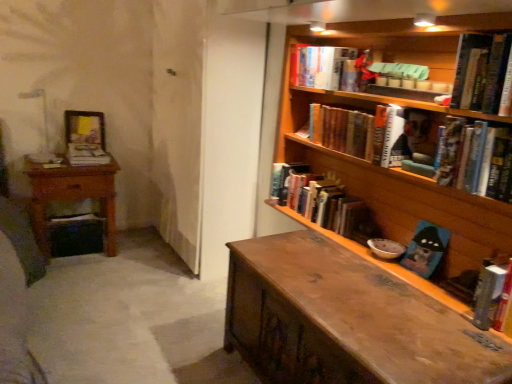
What is the approximate height of hardcover book at upper right, the 3th book positioned from the right?

9.70 inches.

Measure the distance between white matte book at left, placed as the first book when sorted from left to right, and camera.

white matte book at left, placed as the first book when sorted from left to right, is 8.66 feet from camera.

Describe the element at coordinates (87, 155) in the screenshot. The width and height of the screenshot is (512, 384). I see `white matte book at left, placed as the first book when sorted from left to right` at that location.

What do you see at coordinates (345, 320) in the screenshot? I see `wooden desk at center` at bounding box center [345, 320].

What do you see at coordinates (85, 128) in the screenshot? Image resolution: width=512 pixels, height=384 pixels. I see `wooden picture frame at upper left` at bounding box center [85, 128].

The height and width of the screenshot is (384, 512). I want to click on hardcover book at upper right, the 4th book viewed from the right, so click(369, 132).

The image size is (512, 384). I want to click on hardcover book at upper right, which ranks as the sixth book in left-to-right order, so click(x=482, y=72).

Describe the element at coordinates (482, 72) in the screenshot. I see `hardcover book at upper right, which ranks as the sixth book in left-to-right order` at that location.

This screenshot has width=512, height=384. What do you see at coordinates (322, 201) in the screenshot? I see `hardcover book at center, the 3th book positioned from the left` at bounding box center [322, 201].

Identify the location of hardcover book at upper right, the 3th book positioned from the right. (476, 158).

Are wooden nightstand at left and hardcover book at upper right, which appears as the 2th book when viewed from the right, located far from each other?

Yes, wooden nightstand at left and hardcover book at upper right, which appears as the 2th book when viewed from the right, are located far from each other.

Considering the sizes of objects wooden nightstand at left and hardcover book at upper right, which ranks as the sixth book in left-to-right order, in the image provided, who is shorter, wooden nightstand at left or hardcover book at upper right, which ranks as the sixth book in left-to-right order,?

Standing shorter between the two is hardcover book at upper right, which ranks as the sixth book in left-to-right order.

Considering the relative sizes of wooden nightstand at left and hardcover book at upper right, which ranks as the sixth book in left-to-right order, in the image provided, is wooden nightstand at left bigger than hardcover book at upper right, which ranks as the sixth book in left-to-right order,?

Correct, wooden nightstand at left is larger in size than hardcover book at upper right, which ranks as the sixth book in left-to-right order.

Is wooden nightstand at left turned away from hardcover book at upper right, which ranks as the sixth book in left-to-right order?

wooden nightstand at left does not have its back to hardcover book at upper right, which ranks as the sixth book in left-to-right order.

From the picture: Considering the relative sizes of wooden nightstand at left and hardcover book at upper right, the 5th book positioned from the left, in the image provided, is wooden nightstand at left smaller than hardcover book at upper right, the 5th book positioned from the left,?

Incorrect, wooden nightstand at left is not smaller in size than hardcover book at upper right, the 5th book positioned from the left.

Looking at this image, from a real-world perspective, which is physically below, wooden nightstand at left or hardcover book at upper right, the 3th book positioned from the right?

wooden nightstand at left, from a real-world perspective.

Is wooden nightstand at left oriented away from hardcover book at upper right, the 3th book positioned from the right?

No, wooden nightstand at left is not facing the opposite direction of hardcover book at upper right, the 3th book positioned from the right.

Between wooden nightstand at left and hardcover book at upper right, the 5th book positioned from the left, which one has larger width?

wooden nightstand at left.

Is point (476, 35) closer or farther from the camera than point (350, 54)?

Point (476, 35) is positioned closer to the camera compared to point (350, 54).

Considering the sizes of hardcover book at upper right, which ranks as the sixth book in left-to-right order, and hardcover book at upper center, which is the 6th book from right to left, in the image, is hardcover book at upper right, which ranks as the sixth book in left-to-right order, taller or shorter than hardcover book at upper center, which is the 6th book from right to left,?

Clearly, hardcover book at upper right, which ranks as the sixth book in left-to-right order, is taller compared to hardcover book at upper center, which is the 6th book from right to left.

Is hardcover book at upper right, which ranks as the sixth book in left-to-right order, spatially inside hardcover book at upper center, which is the 6th book from right to left, or outside of it?

hardcover book at upper right, which ranks as the sixth book in left-to-right order, is not enclosed by hardcover book at upper center, which is the 6th book from right to left.

Based on their positions, is white matte book at left, which is the seventh book from right to left, located to the left or right of hardcover book at upper center, which is counted as the second book, starting from the left?

Clearly, white matte book at left, which is the seventh book from right to left, is on the left of hardcover book at upper center, which is counted as the second book, starting from the left, in the image.

Which is behind, white matte book at left, placed as the first book when sorted from left to right, or hardcover book at upper center, which is the 6th book from right to left?

Positioned behind is white matte book at left, placed as the first book when sorted from left to right.

Considering the relative sizes of white matte book at left, placed as the first book when sorted from left to right, and hardcover book at upper center, which is counted as the second book, starting from the left, in the image provided, is white matte book at left, placed as the first book when sorted from left to right, bigger than hardcover book at upper center, which is counted as the second book, starting from the left,?

Incorrect, white matte book at left, placed as the first book when sorted from left to right, is not larger than hardcover book at upper center, which is counted as the second book, starting from the left.

Measure the distance between white matte book at left, which is the seventh book from right to left, and hardcover book at upper center, which is counted as the second book, starting from the left.

white matte book at left, which is the seventh book from right to left, and hardcover book at upper center, which is counted as the second book, starting from the left, are 4.99 feet apart.

In the scene shown: From a real-world perspective, who is located lower, hardcover book at upper right, the fourth book from the left, or hardcover book at right, arranged as the first book when viewed from the right?

hardcover book at right, arranged as the first book when viewed from the right, from a real-world perspective.

Is hardcover book at upper right, the 4th book viewed from the right, not close to hardcover book at right, arranged as the first book when viewed from the right?

No, hardcover book at upper right, the 4th book viewed from the right, is not far from hardcover book at right, arranged as the first book when viewed from the right.

In the image, is hardcover book at upper right, the fourth book from the left, positioned in front of or behind hardcover book at right, marked as the seventh book in a left-to-right arrangement?

hardcover book at upper right, the fourth book from the left, is positioned farther from the viewer than hardcover book at right, marked as the seventh book in a left-to-right arrangement.

Which of these two, hardcover book at upper right, the 3th book positioned from the right, or wooden nightstand at left, stands taller?

wooden nightstand at left is taller.

Is hardcover book at upper right, the 3th book positioned from the right, oriented away from wooden nightstand at left?

hardcover book at upper right, the 3th book positioned from the right, does not have its back to wooden nightstand at left.

Which of these two, hardcover book at upper right, the 5th book positioned from the left, or wooden nightstand at left, is smaller?

With smaller size is hardcover book at upper right, the 5th book positioned from the left.

Are hardcover book at upper right, the 5th book positioned from the left, and wooden nightstand at left located far from each other?

Yes.

Looking at this image, considering the relative positions of white matte book at left, which is the seventh book from right to left, and hardcover book at upper right, which appears as the 2th book when viewed from the right, in the image provided, is white matte book at left, which is the seventh book from right to left, in front of hardcover book at upper right, which appears as the 2th book when viewed from the right,?

No, white matte book at left, which is the seventh book from right to left, is further to the viewer.

Is white matte book at left, placed as the first book when sorted from left to right, shorter than hardcover book at upper right, which appears as the 2th book when viewed from the right?

Yes.

Who is smaller, white matte book at left, placed as the first book when sorted from left to right, or hardcover book at upper right, which appears as the 2th book when viewed from the right?

white matte book at left, placed as the first book when sorted from left to right.

Considering the relative sizes of white matte book at left, placed as the first book when sorted from left to right, and hardcover book at upper right, which appears as the 2th book when viewed from the right, in the image provided, is white matte book at left, placed as the first book when sorted from left to right, wider than hardcover book at upper right, which appears as the 2th book when viewed from the right,?

Yes, white matte book at left, placed as the first book when sorted from left to right, is wider than hardcover book at upper right, which appears as the 2th book when viewed from the right.

There is a wooden nightstand at left. At what (x,y) coordinates should I click in order to perform the action: click on the 5th book above it (from the image's perspective). Please return your answer as a coordinate pair (x, y). Looking at the image, I should click on (482, 72).

You are a GUI agent. You are given a task and a screenshot of the screen. Output one action in this format:
    pyautogui.click(x=<x>, y=<y>)
    Task: Click on the nightstand located underneath the hardcover book at upper right, the 3th book positioned from the right (from a real-world perspective)
    
    Given the screenshot: What is the action you would take?
    pyautogui.click(x=72, y=195)

Which object lies further to the anchor point wooden desk at center, wooden bookshelf at upper right or wooden nightstand at left?

wooden nightstand at left.

Considering their positions, is hardcover book at upper center, which is counted as the second book, starting from the left, positioned closer to hardcover book at upper right, which appears as the 2th book when viewed from the right, than wooden nightstand at left?

hardcover book at upper center, which is counted as the second book, starting from the left, lies closer to hardcover book at upper right, which appears as the 2th book when viewed from the right, than the other object.

From the picture: Based on their spatial positions, is hardcover book at upper right, which appears as the 2th book when viewed from the right, or hardcover book at center, the 3th book positioned from the left, further from white matte book at left, placed as the first book when sorted from left to right?

Among the two, hardcover book at upper right, which appears as the 2th book when viewed from the right, is located further to white matte book at left, placed as the first book when sorted from left to right.

From the image, which object appears to be nearer to white matte book at left, placed as the first book when sorted from left to right, hardcover book at upper right, the fourth book from the left, or wooden picture frame at upper left?

wooden picture frame at upper left is positioned closer to the anchor white matte book at left, placed as the first book when sorted from left to right.

From the image, which object appears to be nearer to hardcover book at upper right, the 4th book viewed from the right, hardcover book at upper center, which is counted as the second book, starting from the left, or wooden picture frame at upper left?

hardcover book at upper center, which is counted as the second book, starting from the left, is positioned closer to the anchor hardcover book at upper right, the 4th book viewed from the right.

From the image, which object appears to be nearer to wooden nightstand at left, wooden picture frame at upper left or hardcover book at right, marked as the seventh book in a left-to-right arrangement?

wooden picture frame at upper left.

In the scene shown: Based on their spatial positions, is wooden picture frame at upper left or wooden desk at center closer to hardcover book at upper right, which ranks as the sixth book in left-to-right order?

wooden desk at center is closer to hardcover book at upper right, which ranks as the sixth book in left-to-right order.

Looking at the image, which one is located closer to wooden bookshelf at upper right, wooden desk at center or white matte book at left, placed as the first book when sorted from left to right?

wooden desk at center lies closer to wooden bookshelf at upper right than the other object.

You are a GUI agent. You are given a task and a screenshot of the screen. Output one action in this format:
    pyautogui.click(x=<x>, y=<y>)
    Task: Click on the picture frame between wooden nightstand at left and hardcover book at center, the 3th book positioned from the left
    This screenshot has height=384, width=512.
    Given the screenshot: What is the action you would take?
    pyautogui.click(x=85, y=128)

You are a GUI agent. You are given a task and a screenshot of the screen. Output one action in this format:
    pyautogui.click(x=<x>, y=<y>)
    Task: Click on the desk between wooden picture frame at upper left and hardcover book at upper right, the 5th book positioned from the left
    
    Given the screenshot: What is the action you would take?
    pyautogui.click(x=345, y=320)

You are a GUI agent. You are given a task and a screenshot of the screen. Output one action in this format:
    pyautogui.click(x=<x>, y=<y>)
    Task: Click on the bookcase located between wooden picture frame at upper left and hardcover book at upper right, which ranks as the sixth book in left-to-right order, in the left-right direction
    The width and height of the screenshot is (512, 384).
    Given the screenshot: What is the action you would take?
    pyautogui.click(x=399, y=168)

The height and width of the screenshot is (384, 512). I want to click on desk between wooden nightstand at left and wooden bookshelf at upper right, so click(x=345, y=320).